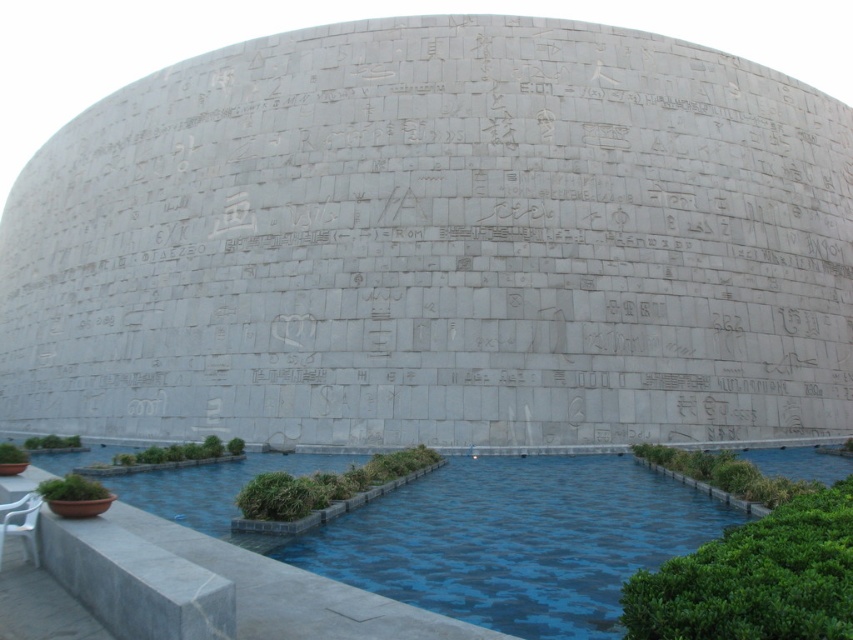
Question: Which point is closer to the camera taking this photo?

Choices:
 (A) (9, 502)
 (B) (669, 502)

Answer: (A)

Question: Which point is farther to the camera?

Choices:
 (A) white plastic chair at lower left
 (B) blue concrete pool at lower center

Answer: (A)

Question: Can you confirm if blue concrete pool at lower center is smaller than white plastic chair at lower left?

Choices:
 (A) no
 (B) yes

Answer: (A)

Question: Does blue concrete pool at lower center appear on the left side of white plastic chair at lower left?

Choices:
 (A) yes
 (B) no

Answer: (B)

Question: Can you confirm if blue concrete pool at lower center is bigger than white plastic chair at lower left?

Choices:
 (A) yes
 (B) no

Answer: (A)